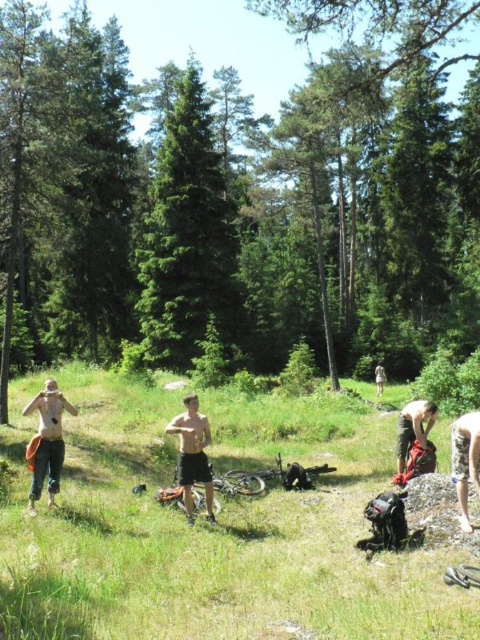
Question: Can you confirm if green leafy tree at center is positioned to the right of green matte tree at center?

Choices:
 (A) yes
 (B) no

Answer: (A)

Question: Observing the image, what is the correct spatial positioning of green grassy field at center in reference to light brown wooden stick at center?

Choices:
 (A) right
 (B) left

Answer: (B)

Question: Which of the following is the farthest from the observer?

Choices:
 (A) black matte shorts at center
 (B) skinny jeans at lower right

Answer: (A)

Question: Does green leafy tree at center have a greater width compared to green matte tree at center?

Choices:
 (A) yes
 (B) no

Answer: (A)

Question: Which object is the farthest from the denim pants at left?

Choices:
 (A) green matte tree at center
 (B) black matte shorts at center
 (C) skinny jeans at lower right
 (D) green grassy field at center

Answer: (A)

Question: Which of these objects is positioned closest to the light brown wooden stick at center?

Choices:
 (A) denim pants at left
 (B) black matte shorts at center

Answer: (B)